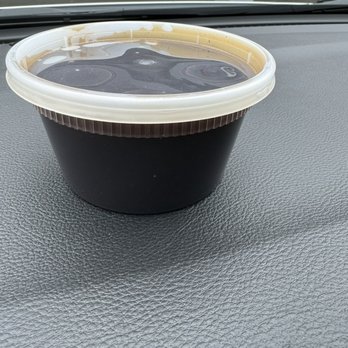
You are a GUI agent. You are given a task and a screenshot of the screen. Output one action in this format:
    pyautogui.click(x=<x>, y=<y>)
    Task: Click on the vent
    The height and width of the screenshot is (348, 348).
    Given the screenshot: What is the action you would take?
    coord(24,19)